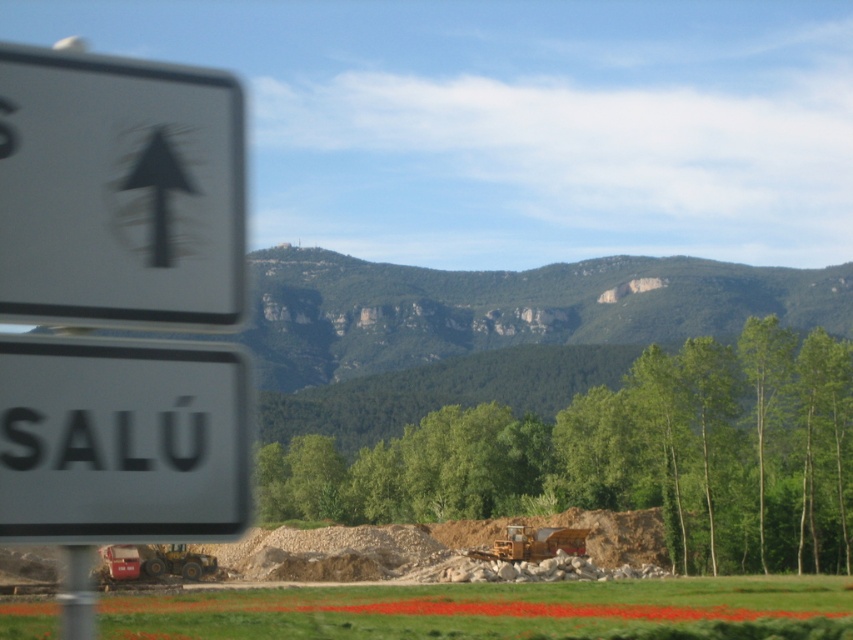
You are a surveyor checking the construction site. You see the metallic pole at left and the yellow metallic excavator at center. Which object is positioned higher in the image?

The metallic pole at left is located above the yellow metallic excavator at center, so it is positioned higher in the image.

Where is the white plastic arrow at upper left located in terms of coordinates?

The white plastic arrow at upper left is located at coordinates point (119,192).

You are a surveyor checking the construction site. You need to determine if the metallic pole at left can be placed next to the yellow metallic excavator at center without overlapping. Given that the excavator is currently occupying a space narrower than the pole, can they both fit side by side?

The metallic pole at left has a larger width than the yellow metallic excavator at center. Since the excavator is in a space narrower than the pole, there isn